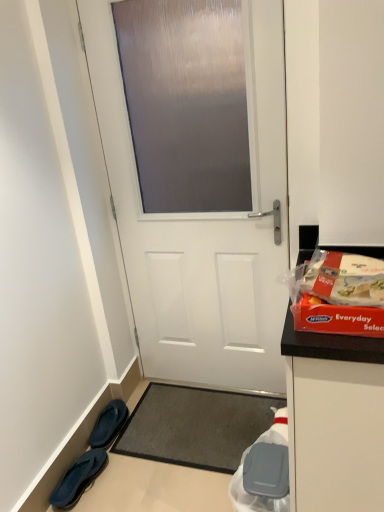
Locate an element on the screen. The width and height of the screenshot is (384, 512). blank space above red plastic box at right, acting as the 1th waste starting from the front (from a real-world perspective) is located at coordinates (346, 281).